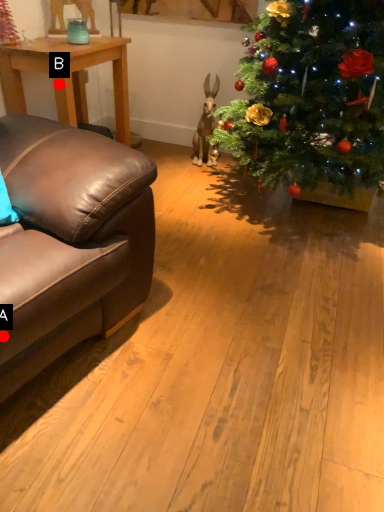
Question: Two points are circled on the image, labeled by A and B beside each circle. Among these points, which one is nearest to the camera?

Choices:
 (A) A is closer
 (B) B is closer

Answer: (A)